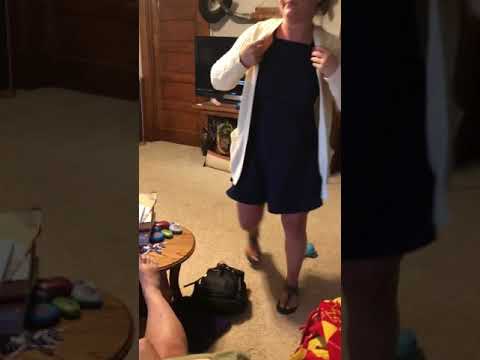
Where is `door`? door is located at coordinates (175, 70).